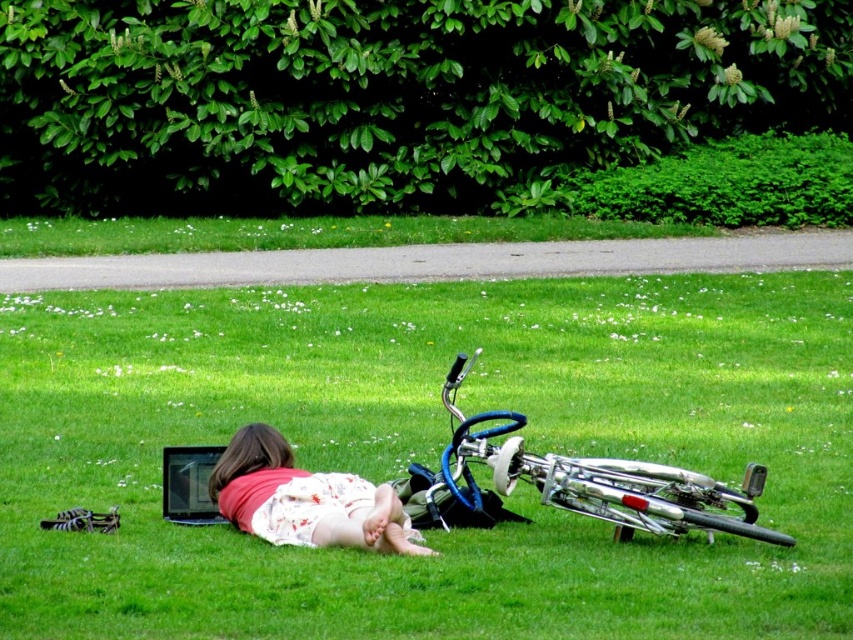
You are a photographer wanting to capture the silver metallic bicycle at lower center and the floral dress at center in a single shot. Based on their positions, which object should you position closer to the camera to ensure both are fully visible in the frame?

The silver metallic bicycle at lower center is to the right of the floral dress at center. To ensure both are fully visible, position the floral dress at center closer to the camera since the bicycle is already to its right, allowing both to fit within the frame.

You are planning to set up a small picnic blanket in the park scene. The picnic blanket is 1.5 meters wide. Considering the green grass at center and the silver metallic bicycle at lower center, which area would be more suitable for placing the blanket without overlapping the bicycle?

The green grass at center is larger in size than the silver metallic bicycle at lower center, so placing the picnic blanket on the green grass at center would provide enough space to avoid overlapping the bicycle.